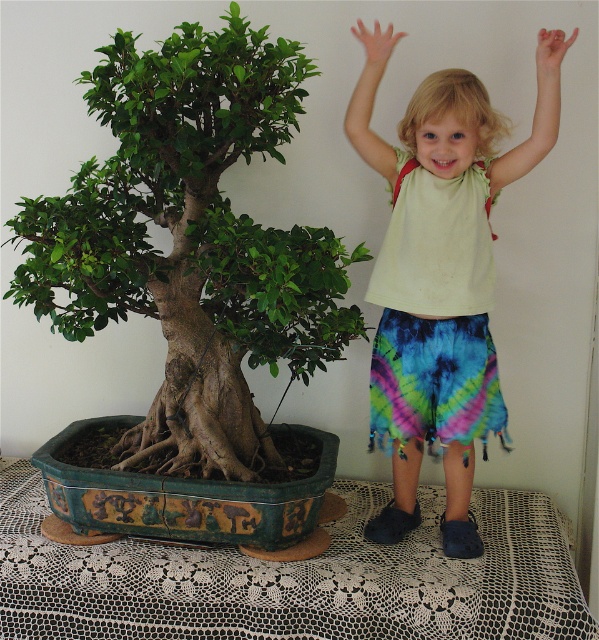
You are a photographer trying to capture the bonsai tree and the child in the scene. You need to adjust your camera focus so that the point closer to you is in sharp focus. Which point should you focus on, point (129, 234) or point (398, 451)?

You should focus on point (129, 234) because it is closer to the viewer than point (398, 451), ensuring it will be in sharp focus.

What is the exact coordinate of the green leafy bonsai at left in the image?

The green leafy bonsai at left is located at point [190,241].